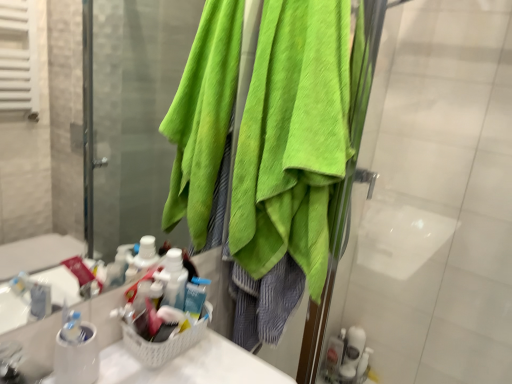
The height and width of the screenshot is (384, 512). Describe the element at coordinates (354, 356) in the screenshot. I see `white glossy toothbrush at lower right, the second toiletry when ordered from left to right` at that location.

This screenshot has height=384, width=512. Identify the location of translucent plastic soap dispenser at lower right, arranged as the 2th toiletry when viewed from the right. [x=334, y=356].

The width and height of the screenshot is (512, 384). I want to click on white glossy toothbrush at lower right, the second toiletry when ordered from left to right, so click(354, 356).

What are the coordinates of `toiletry on the right of translucent plastic soap dispenser at lower right, the first toiletry viewed from the left` in the screenshot? It's located at (354, 356).

Is white glossy toothbrush at lower right, the second toiletry when ordered from left to right, situated inside translucent plastic soap dispenser at lower right, the first toiletry viewed from the left, or outside?

white glossy toothbrush at lower right, the second toiletry when ordered from left to right, exists outside the volume of translucent plastic soap dispenser at lower right, the first toiletry viewed from the left.

Looking at this image, does white glossy toothbrush at lower right, the second toiletry when ordered from left to right, have a greater width compared to translucent plastic soap dispenser at lower right, the first toiletry viewed from the left?

Yes, white glossy toothbrush at lower right, the second toiletry when ordered from left to right, is wider than translucent plastic soap dispenser at lower right, the first toiletry viewed from the left.

Is white glossy toothbrush at lower right, which appears as the first toiletry when viewed from the right, positioned with its back to translucent plastic soap dispenser at lower right, the first toiletry viewed from the left?

No, white glossy toothbrush at lower right, which appears as the first toiletry when viewed from the right, is not facing away from translucent plastic soap dispenser at lower right, the first toiletry viewed from the left.

From the image's perspective, would you say white glossy toothbrush at lower right, the second toiletry when ordered from left to right, is positioned over green towel at upper right?

No.

Is green towel at upper right located within white glossy toothbrush at lower right, the second toiletry when ordered from left to right?

No, green towel at upper right is not a part of white glossy toothbrush at lower right, the second toiletry when ordered from left to right.

This screenshot has width=512, height=384. I want to click on toiletry that is the 1st one when counting leftward from the green towel at upper right, so click(354, 356).

From a real-world perspective, is white glossy toothbrush at lower right, the second toiletry when ordered from left to right, physically located above or below green towel at upper right?

In terms of real-world spatial position, white glossy toothbrush at lower right, the second toiletry when ordered from left to right, is below green towel at upper right.

Find the location of `the 2nd toiletry behind the green towel at upper right, counting from the anchor's position`. the 2nd toiletry behind the green towel at upper right, counting from the anchor's position is located at coordinates (354, 356).

Looking at the image, does green towel at upper right seem bigger or smaller compared to white glossy toothbrush at lower right, which appears as the first toiletry when viewed from the right?

In the image, green towel at upper right appears to be larger than white glossy toothbrush at lower right, which appears as the first toiletry when viewed from the right.

Is green towel at upper right completely or partially outside of white glossy toothbrush at lower right, the second toiletry when ordered from left to right?

Yes.

Does green towel at upper right appear on the left side of white glossy toothbrush at lower right, the second toiletry when ordered from left to right?

No, green towel at upper right is not to the left of white glossy toothbrush at lower right, the second toiletry when ordered from left to right.

Is green towel at upper right turned away from translucent plastic soap dispenser at lower right, the first toiletry viewed from the left?

That's not correct — green towel at upper right is not looking away from translucent plastic soap dispenser at lower right, the first toiletry viewed from the left.

Consider the image. Is green towel at upper right bigger or smaller than translucent plastic soap dispenser at lower right, the first toiletry viewed from the left?

Clearly, green towel at upper right is larger in size than translucent plastic soap dispenser at lower right, the first toiletry viewed from the left.

Does green towel at upper right have a greater height compared to translucent plastic soap dispenser at lower right, the first toiletry viewed from the left?

Yes.

Between green towel at upper right and translucent plastic soap dispenser at lower right, arranged as the 2th toiletry when viewed from the right, which one is positioned behind?

translucent plastic soap dispenser at lower right, arranged as the 2th toiletry when viewed from the right, is further away from the camera.

In terms of height, does translucent plastic soap dispenser at lower right, arranged as the 2th toiletry when viewed from the right, look taller or shorter compared to green towel at upper right?

Clearly, translucent plastic soap dispenser at lower right, arranged as the 2th toiletry when viewed from the right, is shorter compared to green towel at upper right.

Is translucent plastic soap dispenser at lower right, the first toiletry viewed from the left, positioned in front of green towel at upper right?

No, translucent plastic soap dispenser at lower right, the first toiletry viewed from the left, is further to the viewer.

From the image's perspective, is translucent plastic soap dispenser at lower right, arranged as the 2th toiletry when viewed from the right, under green towel at upper right?

Correct, translucent plastic soap dispenser at lower right, arranged as the 2th toiletry when viewed from the right, appears lower than green towel at upper right in the image.

Are translucent plastic soap dispenser at lower right, arranged as the 2th toiletry when viewed from the right, and green towel at upper right far apart?

translucent plastic soap dispenser at lower right, arranged as the 2th toiletry when viewed from the right, is actually quite close to green towel at upper right.

Between translucent plastic soap dispenser at lower right, arranged as the 2th toiletry when viewed from the right, and white glossy toothbrush at lower right, the second toiletry when ordered from left to right, which one has larger width?

white glossy toothbrush at lower right, the second toiletry when ordered from left to right.

Is translucent plastic soap dispenser at lower right, the first toiletry viewed from the left, outside of white glossy toothbrush at lower right, the second toiletry when ordered from left to right?

Absolutely, translucent plastic soap dispenser at lower right, the first toiletry viewed from the left, is external to white glossy toothbrush at lower right, the second toiletry when ordered from left to right.

From the picture: From a real-world perspective, is translucent plastic soap dispenser at lower right, the first toiletry viewed from the left, physically below white glossy toothbrush at lower right, the second toiletry when ordered from left to right?

Yes.

Is translucent plastic soap dispenser at lower right, the first toiletry viewed from the left, to the left of white glossy toothbrush at lower right, the second toiletry when ordered from left to right, from the viewer's perspective?

Correct, you'll find translucent plastic soap dispenser at lower right, the first toiletry viewed from the left, to the left of white glossy toothbrush at lower right, the second toiletry when ordered from left to right.

Locate an element on the screen. This screenshot has height=384, width=512. toiletry that is on the right side of translucent plastic soap dispenser at lower right, arranged as the 2th toiletry when viewed from the right is located at coordinates (354, 356).

This screenshot has height=384, width=512. In order to click on screen door located in front of the white glossy toothbrush at lower right, the second toiletry when ordered from left to right in this screenshot , I will do `click(441, 203)`.

Consider the image. Estimate the real-world distances between objects in this image. Which object is closer to green towel at upper right, translucent plastic soap dispenser at lower right, the first toiletry viewed from the left, or white glossy toothbrush at lower right, which appears as the first toiletry when viewed from the right?

white glossy toothbrush at lower right, which appears as the first toiletry when viewed from the right, is closer to green towel at upper right.

Which object lies nearer to the anchor point white glossy toothbrush at lower right, the second toiletry when ordered from left to right, translucent plastic soap dispenser at lower right, arranged as the 2th toiletry when viewed from the right, or green towel at upper right?

translucent plastic soap dispenser at lower right, arranged as the 2th toiletry when viewed from the right, is positioned closer to the anchor white glossy toothbrush at lower right, the second toiletry when ordered from left to right.

Looking at the image, which one is located closer to white glossy toothbrush at lower right, which appears as the first toiletry when viewed from the right, green towel at upper right or translucent plastic soap dispenser at lower right, the first toiletry viewed from the left?

translucent plastic soap dispenser at lower right, the first toiletry viewed from the left.

When comparing their distances from translucent plastic soap dispenser at lower right, the first toiletry viewed from the left, does green towel at upper right or white glossy toothbrush at lower right, which appears as the first toiletry when viewed from the right, seem further?

green towel at upper right is positioned further to the anchor translucent plastic soap dispenser at lower right, the first toiletry viewed from the left.

Looking at this image, from the image, which object appears to be nearer to translucent plastic soap dispenser at lower right, arranged as the 2th toiletry when viewed from the right, white glossy toothbrush at lower right, the second toiletry when ordered from left to right, or green towel at upper right?

white glossy toothbrush at lower right, the second toiletry when ordered from left to right, lies closer to translucent plastic soap dispenser at lower right, arranged as the 2th toiletry when viewed from the right, than the other object.

Considering their positions, is white glossy toothbrush at lower right, which appears as the first toiletry when viewed from the right, positioned further to green towel at upper right than translucent plastic soap dispenser at lower right, the first toiletry viewed from the left?

translucent plastic soap dispenser at lower right, the first toiletry viewed from the left, lies further to green towel at upper right than the other object.

The image size is (512, 384). What are the coordinates of `toiletry between green towel at upper right and white glossy toothbrush at lower right, the second toiletry when ordered from left to right, in the front-back direction` in the screenshot? It's located at (334, 356).